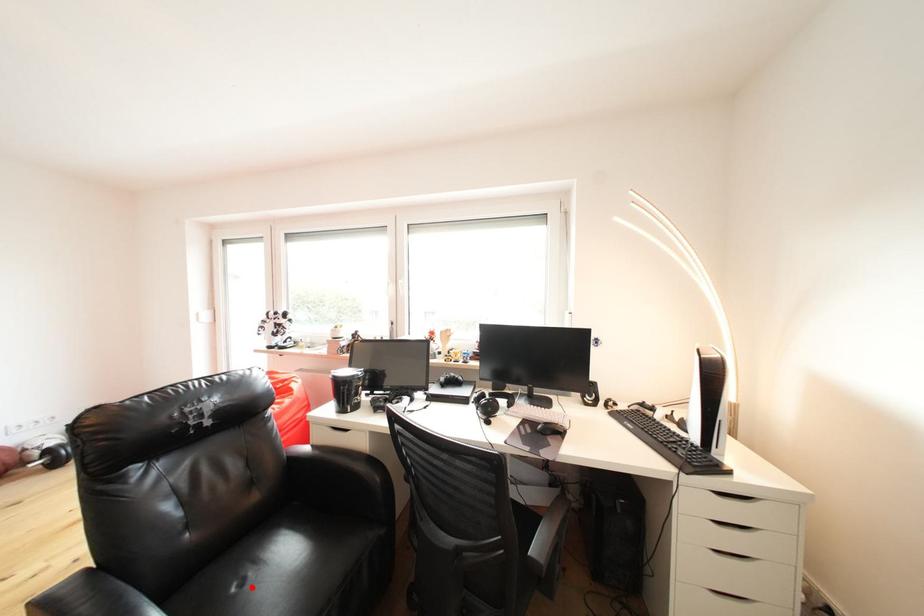
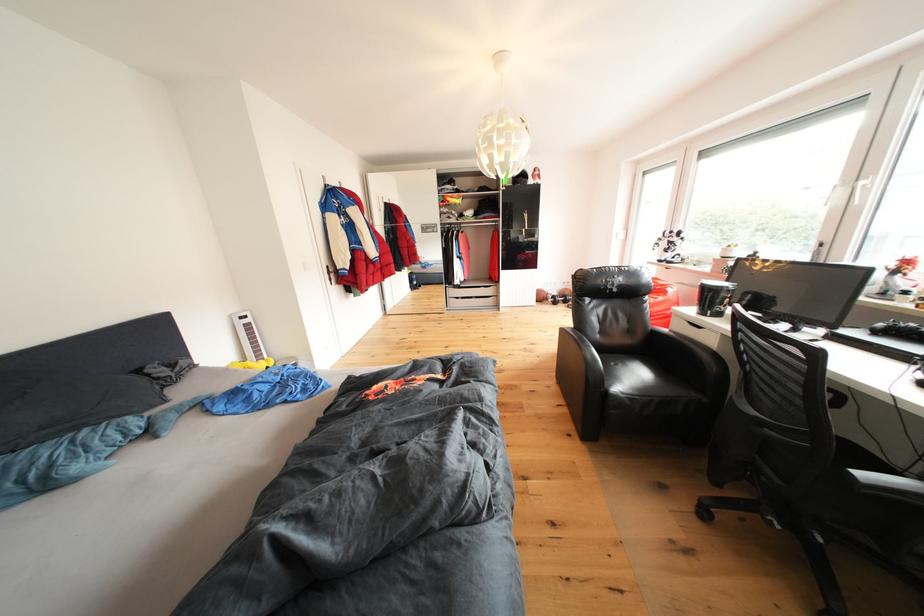
Where in the second image is the point corresponding to the highlighted location from the first image?

(625, 370)